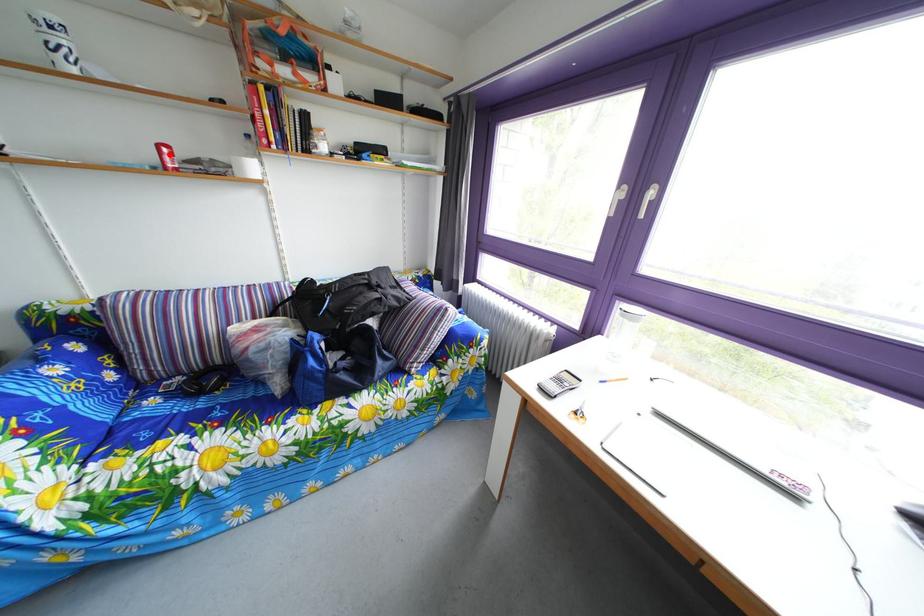
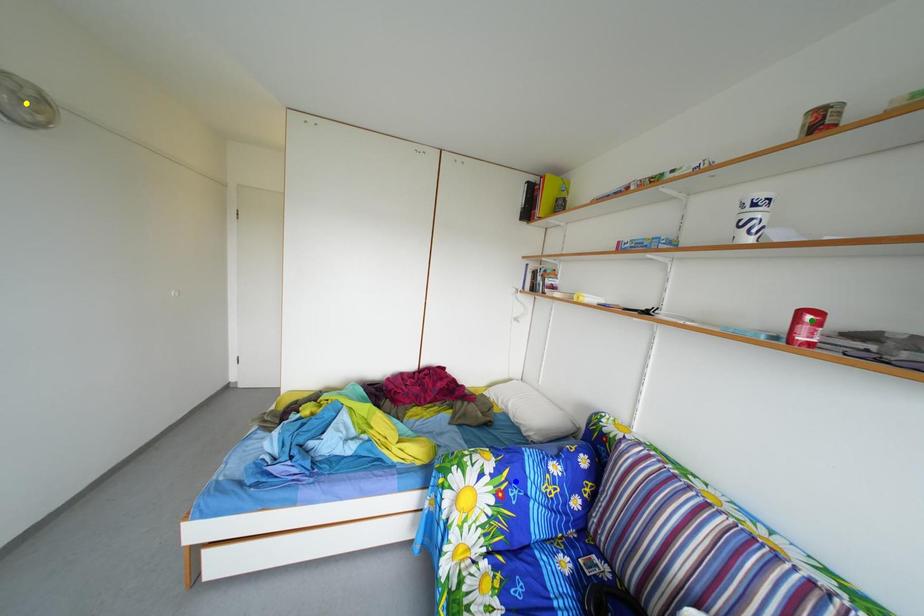
Question: I am providing you with two images of the same scene from different viewpoints. A red point is marked on the first image. You are given multiple points on the second image. Which mark in image 2 goes with the point in image 1?

Choices:
 (A) blue point
 (B) green point
 (C) yellow point

Answer: (B)